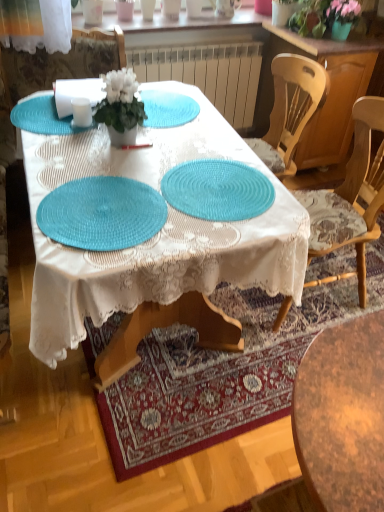
Where is `free space that is in between teal woven placemat at center, positioned as the 3th glass plate in top-to-bottom order, and white matte pot at center`? free space that is in between teal woven placemat at center, positioned as the 3th glass plate in top-to-bottom order, and white matte pot at center is located at coordinates (107, 166).